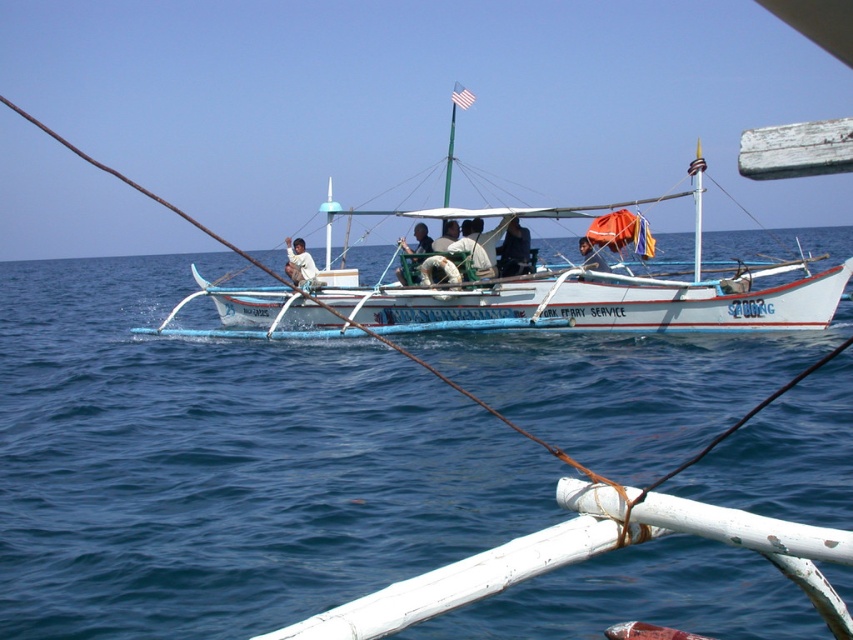
Question: Can you confirm if light brown wooden boat at center is bigger than light brown wooden chair at center?

Choices:
 (A) yes
 (B) no

Answer: (A)

Question: Considering the real-world distances, which object is closest to the dark blue fabric at center?

Choices:
 (A) light brown wooden chair at center
 (B) light brown wooden boat at center
 (C) white wooden boat at center

Answer: (C)

Question: Which point appears farthest from the camera in this image?

Choices:
 (A) (167, 452)
 (B) (473, 228)

Answer: (B)

Question: Which of the following is the farthest from the observer?

Choices:
 (A) white fabric shirt at center
 (B) light brown woven hat at center

Answer: (B)

Question: In this image, where is white wooden boat at center located relative to light brown wooden boat at center?

Choices:
 (A) below
 (B) above

Answer: (A)

Question: Can you confirm if white wooden boat at center is positioned to the left of dark blue fabric at center?

Choices:
 (A) yes
 (B) no

Answer: (A)